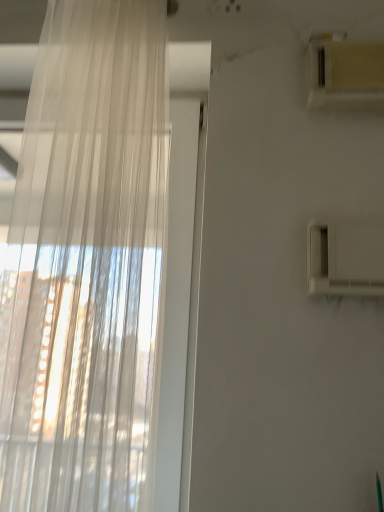
Question: From the image's perspective, is translucent fabric curtain at left on white plastic air conditioning unit at upper right?

Choices:
 (A) yes
 (B) no

Answer: (B)

Question: Are translucent fabric curtain at left and white plastic air conditioning unit at upper right far apart?

Choices:
 (A) yes
 (B) no

Answer: (B)

Question: Is the depth of translucent fabric curtain at left greater than that of white plastic air conditioning unit at upper right?

Choices:
 (A) no
 (B) yes

Answer: (A)

Question: From a real-world perspective, is translucent fabric curtain at left positioned over white plastic air conditioning unit at upper right based on gravity?

Choices:
 (A) no
 (B) yes

Answer: (A)

Question: Does translucent fabric curtain at left have a larger size compared to white plastic air conditioning unit at upper right?

Choices:
 (A) yes
 (B) no

Answer: (A)

Question: Does translucent fabric curtain at left have a lesser width compared to white plastic air conditioning unit at upper right?

Choices:
 (A) yes
 (B) no

Answer: (B)

Question: Can you confirm if white plastic air conditioning unit at upper right is positioned to the left of translucent fabric curtain at left?

Choices:
 (A) yes
 (B) no

Answer: (B)

Question: Considering the relative sizes of white plastic air conditioning unit at upper right and translucent fabric curtain at left in the image provided, is white plastic air conditioning unit at upper right smaller than translucent fabric curtain at left?

Choices:
 (A) no
 (B) yes

Answer: (B)

Question: From the image's perspective, is white plastic air conditioning unit at upper right on translucent fabric curtain at left?

Choices:
 (A) yes
 (B) no

Answer: (A)

Question: Considering the relative sizes of white plastic air conditioning unit at upper right and translucent fabric curtain at left in the image provided, is white plastic air conditioning unit at upper right taller than translucent fabric curtain at left?

Choices:
 (A) no
 (B) yes

Answer: (A)

Question: From a real-world perspective, is white plastic air conditioning unit at upper right located higher than translucent fabric curtain at left?

Choices:
 (A) yes
 (B) no

Answer: (A)

Question: Is translucent fabric curtain at left a part of white plastic air conditioning unit at upper right?

Choices:
 (A) no
 (B) yes

Answer: (A)

Question: Relative to white plastic air conditioning unit at upper right, is translucent fabric curtain at left in front or behind?

Choices:
 (A) behind
 (B) front

Answer: (B)